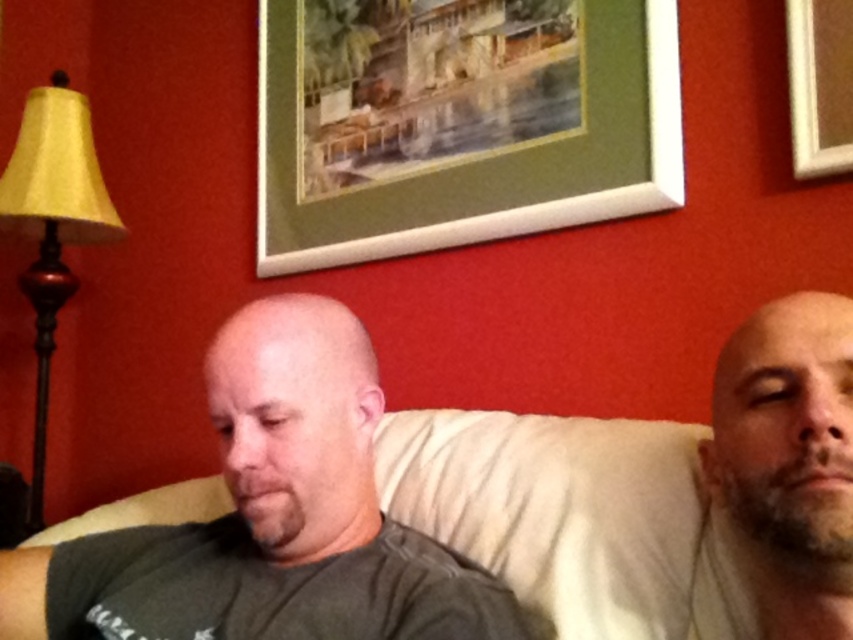
You are an interior designer assessing the living room layout. You need to determine if the green matte picture frame at upper center can be hung above the beige fabric couch at center without obstructing the couch. Based on their sizes, what do you recommend?

The green matte picture frame at upper center is taller than the beige fabric couch at center, so hanging it above the couch may cause the frame to obstruct the couch due to its greater height.

You are standing in front of the couch where the two individuals are seated. You want to hang a new picture frame that is 1.2 meters wide on the wall. The current green matte picture frame at upper center is already there. Can you place your new frame next to it without overlapping?

The green matte picture frame at upper center is 1.35 meters from viewer. Since the distance is more than the new frame width of 1.2 meters, you can place the new frame next to it without overlapping.

You are a photographer holding a camera. You want to take a closeup shot of the beige soft skin at right. The camera requires a minimum distance of 24 inches to focus properly. Can you take the photo from your current position?

The beige soft skin at right and camera are 23.89 inches apart, which is less than the required 24 inches. Therefore, you cannot take the photo from your current position as the camera won